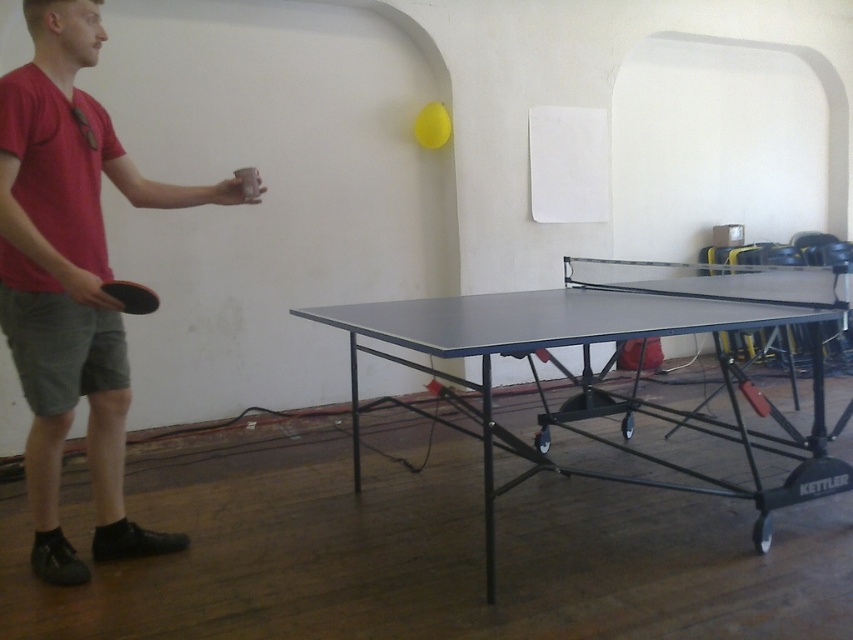
You are a table tennis player preparing to serve. You notice two paddles on the table. Which paddle is positioned higher on the table between the matte red ping pong paddle at left and the black rubber paddle at left?

The matte red ping pong paddle at left is positioned higher because it is above the black rubber paddle at left.

You are standing in the room and want to place a 6 feet long banner on the floor behind the matte black ping pong table at center. Will there be enough space between you and the table to lay it out fully?

The distance between you and the matte black ping pong table at center is 5.89 feet, which is less than the 6 feet required for the banner. Therefore, there isn